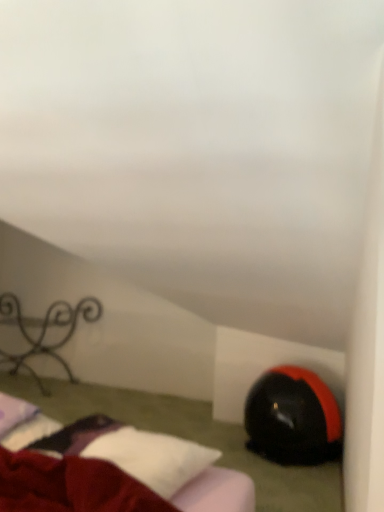
Describe the element at coordinates (45, 331) in the screenshot. I see `iron wrought iron at left` at that location.

Measure the distance between velvet red bed at lower left and camera.

velvet red bed at lower left is 1.07 meters away from camera.

What do you see at coordinates (118, 473) in the screenshot? Image resolution: width=384 pixels, height=512 pixels. I see `velvet red bed at lower left` at bounding box center [118, 473].

The height and width of the screenshot is (512, 384). Identify the location of iron wrought iron at left. (45, 331).

Looking at this image, is velvet red bed at lower left positioned far away from black matte bean bag chair at lower right?

velvet red bed at lower left is actually quite close to black matte bean bag chair at lower right.

From the image's perspective, who appears lower, velvet red bed at lower left or black matte bean bag chair at lower right?

From the image's view, black matte bean bag chair at lower right is below.

Is point (85, 426) closer to camera compared to point (331, 411)?

Yes, point (85, 426) is in front of point (331, 411).

Is velvet red bed at lower left facing away from iron wrought iron at left?

No, iron wrought iron at left is not at the back of velvet red bed at lower left.

Is there a large distance between velvet red bed at lower left and iron wrought iron at left?

velvet red bed at lower left is far away from iron wrought iron at left.

From the image's perspective, is velvet red bed at lower left located beneath iron wrought iron at left?

Yes, from the image's perspective, velvet red bed at lower left is beneath iron wrought iron at left.

Which is farther from the camera, (66, 303) or (94, 476)?

Positioned behind is point (66, 303).

Can you confirm if iron wrought iron at left is shorter than velvet red bed at lower left?

Incorrect, the height of iron wrought iron at left does not fall short of that of velvet red bed at lower left.

Is iron wrought iron at left next to velvet red bed at lower left?

iron wrought iron at left and velvet red bed at lower left are not in contact.

From the image's perspective, would you say iron wrought iron at left is shown under velvet red bed at lower left?

No.

From the image's perspective, is iron wrought iron at left above or below black matte bean bag chair at lower right?

iron wrought iron at left is above black matte bean bag chair at lower right.

Does iron wrought iron at left have a larger size compared to black matte bean bag chair at lower right?

Yes, iron wrought iron at left is bigger than black matte bean bag chair at lower right.

Relative to black matte bean bag chair at lower right, is iron wrought iron at left in front or behind?

Clearly, iron wrought iron at left is behind black matte bean bag chair at lower right.

Would you say iron wrought iron at left is a long distance from black matte bean bag chair at lower right?

iron wrought iron at left is positioned a significant distance from black matte bean bag chair at lower right.

Measure the distance between black matte bean bag chair at lower right and iron wrought iron at left.

black matte bean bag chair at lower right is 5.61 feet from iron wrought iron at left.

In the scene shown: Between black matte bean bag chair at lower right and iron wrought iron at left, which one has smaller width?

iron wrought iron at left.

Looking at this image, does black matte bean bag chair at lower right lie in front of iron wrought iron at left?

Yes, it is in front of iron wrought iron at left.

Considering the positions of objects black matte bean bag chair at lower right and iron wrought iron at left in the image provided, who is more to the left, black matte bean bag chair at lower right or iron wrought iron at left?

From the viewer's perspective, iron wrought iron at left appears more on the left side.

Where is `bean bag chair beneath the velvet red bed at lower left (from a real-world perspective)`? The height and width of the screenshot is (512, 384). bean bag chair beneath the velvet red bed at lower left (from a real-world perspective) is located at coordinates (293, 417).

Considering the relative sizes of black matte bean bag chair at lower right and velvet red bed at lower left in the image provided, is black matte bean bag chair at lower right bigger than velvet red bed at lower left?

Correct, black matte bean bag chair at lower right is larger in size than velvet red bed at lower left.

Is black matte bean bag chair at lower right placed right next to velvet red bed at lower left?

No, black matte bean bag chair at lower right is not touching velvet red bed at lower left.

There is a black matte bean bag chair at lower right. Identify the location of bed above it (from a real-world perspective). The width and height of the screenshot is (384, 512). (118, 473).

You are a GUI agent. You are given a task and a screenshot of the screen. Output one action in this format:
    pyautogui.click(x=<x>, y=<y>)
    Task: Click on the furniture that appears behind the velvet red bed at lower left
    This screenshot has width=384, height=512.
    Given the screenshot: What is the action you would take?
    pyautogui.click(x=45, y=331)

Based on their spatial positions, is velvet red bed at lower left or iron wrought iron at left closer to black matte bean bag chair at lower right?

velvet red bed at lower left is positioned closer to the anchor black matte bean bag chair at lower right.

From the picture: Based on their spatial positions, is iron wrought iron at left or black matte bean bag chair at lower right closer to velvet red bed at lower left?

black matte bean bag chair at lower right is closer to velvet red bed at lower left.

Based on their spatial positions, is iron wrought iron at left or velvet red bed at lower left closer to black matte bean bag chair at lower right?

Based on the image, velvet red bed at lower left appears to be nearer to black matte bean bag chair at lower right.

Which object lies further to the anchor point velvet red bed at lower left, black matte bean bag chair at lower right or iron wrought iron at left?

iron wrought iron at left is further to velvet red bed at lower left.

Estimate the real-world distances between objects in this image. Which object is further from iron wrought iron at left, black matte bean bag chair at lower right or velvet red bed at lower left?

velvet red bed at lower left lies further to iron wrought iron at left than the other object.

Based on their spatial positions, is velvet red bed at lower left or black matte bean bag chair at lower right closer to iron wrought iron at left?

Among the two, black matte bean bag chair at lower right is located nearer to iron wrought iron at left.

The image size is (384, 512). In order to click on bed located between iron wrought iron at left and black matte bean bag chair at lower right in the left-right direction in this screenshot , I will do `click(118, 473)`.